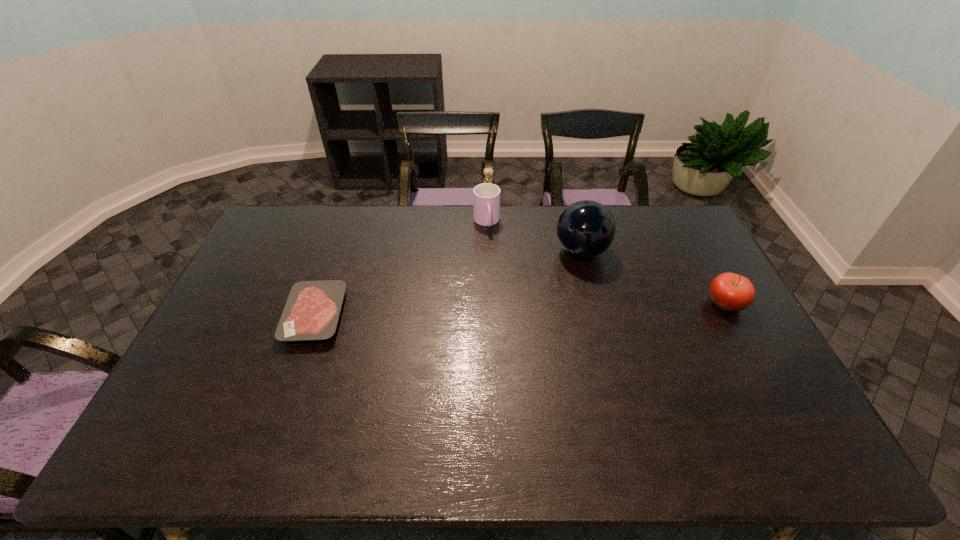
Find the location of a particular element. free space on the desktop that is between the shortest object and the apple and is positioned with the handle on the side of the cup is located at coordinates [x=503, y=310].

At what (x,y) coordinates should I click in order to perform the action: click on vacant spot on the desktop that is between the leftmost object and the rightmost object and is positioned on the side of the tallest object with the finger holes. Please return your answer as a coordinate pair (x, y). The height and width of the screenshot is (540, 960). Looking at the image, I should click on (552, 309).